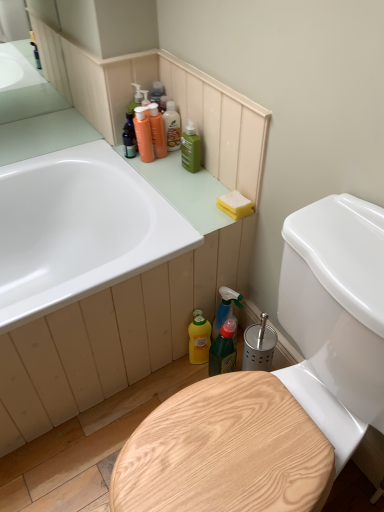
Locate an element on the screen. This screenshot has height=512, width=384. vacant space in front of translucent orange bottle at upper center, arranged as the fifth cleaning product when ordered from the bottom is located at coordinates (166, 173).